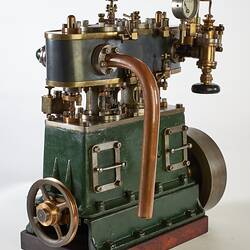
Locate an element on the screen. knob is located at coordinates (210, 92).